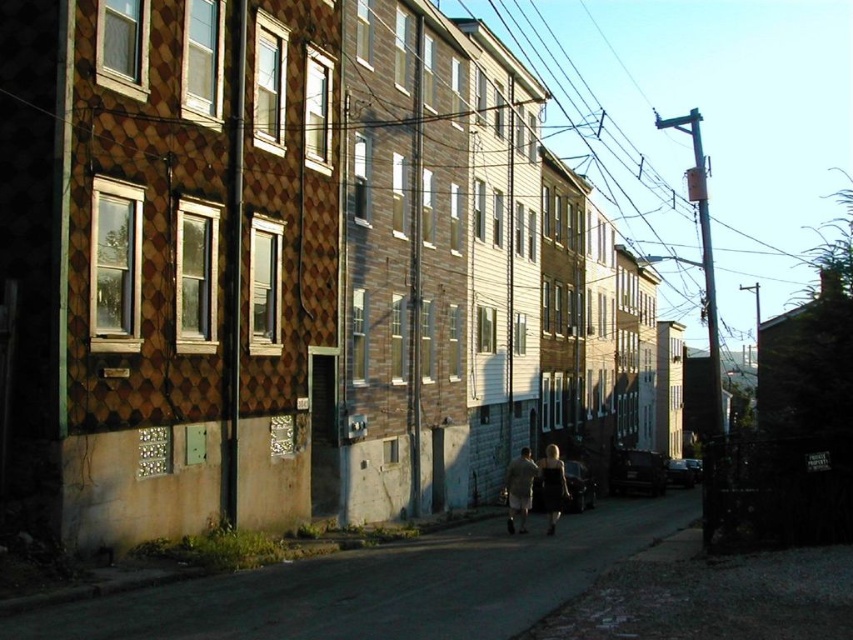
Question: Does smooth concrete alley at center appear on the right side of light brown fabric pants at center?

Choices:
 (A) yes
 (B) no

Answer: (B)

Question: Is light brown fabric pants at center bigger than matte black dress at center?

Choices:
 (A) no
 (B) yes

Answer: (A)

Question: Does light brown fabric pants at center appear over matte black dress at center?

Choices:
 (A) no
 (B) yes

Answer: (B)

Question: Estimate the real-world distances between objects in this image. Which object is closer to the matte black dress at center?

Choices:
 (A) smooth concrete alley at center
 (B) light brown fabric pants at center

Answer: (B)

Question: Which of the following is the farthest from the observer?

Choices:
 (A) (548, 497)
 (B) (511, 497)
 (C) (70, 620)

Answer: (A)

Question: Which point appears closest to the camera in this image?

Choices:
 (A) (509, 461)
 (B) (552, 452)

Answer: (B)